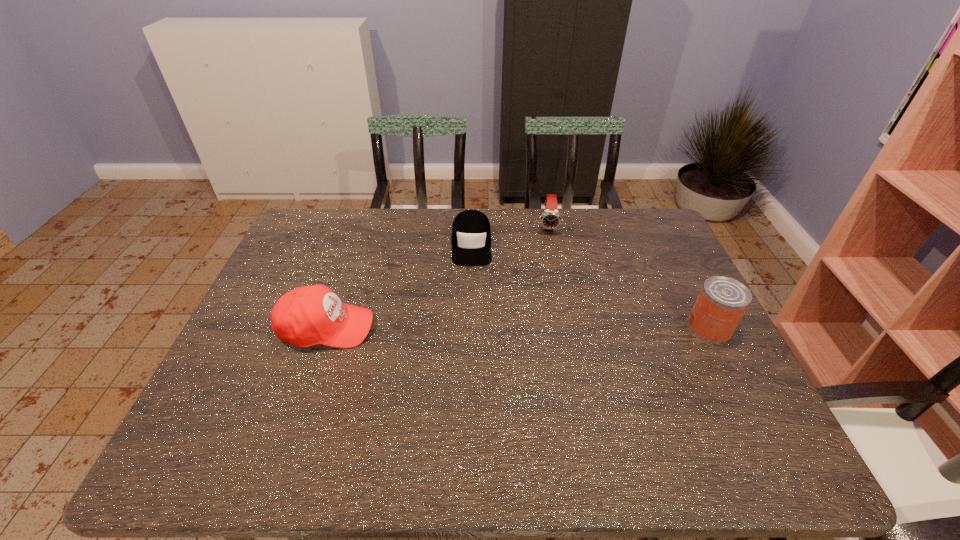
The image size is (960, 540). What are the coordinates of `vacant region between the third object from left to right and the baseball cap` in the screenshot? It's located at (438, 276).

Locate an element on the screen. unoccupied area between the second object from right to left and the rightmost object is located at coordinates (629, 277).

At what (x,y) coordinates should I click in order to perform the action: click on object that is the closest one to the leftmost object. Please return your answer as a coordinate pair (x, y). The image size is (960, 540). Looking at the image, I should click on (471, 235).

Where is `object that is the second closest to the leftmost object`? This screenshot has height=540, width=960. object that is the second closest to the leftmost object is located at coordinates (550, 219).